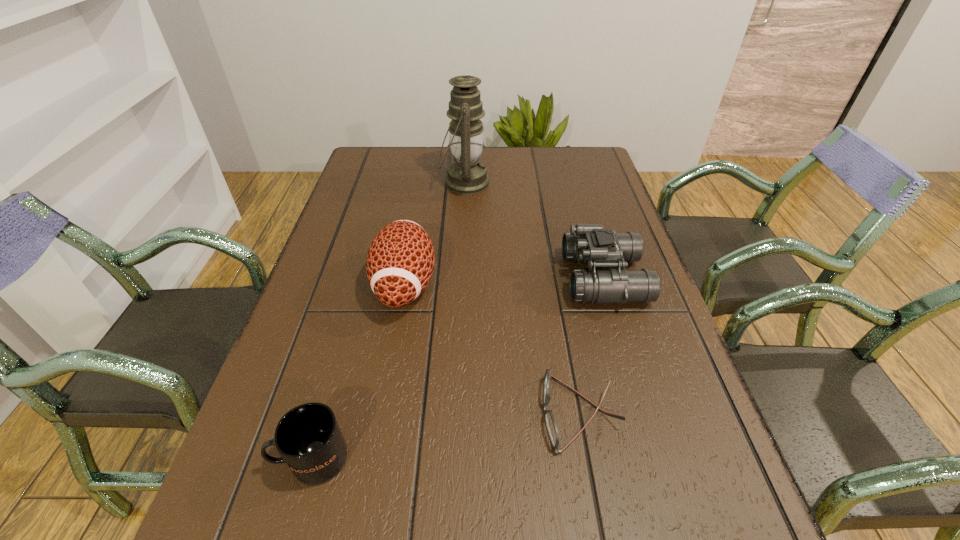
Locate an element on the screen. This screenshot has height=540, width=960. blank space at the left edge of the desktop is located at coordinates (352, 214).

The width and height of the screenshot is (960, 540). In the image, there is a desktop. What are the coordinates of `vacant space at the right edge` in the screenshot? It's located at (615, 204).

At what (x,y) coordinates should I click in order to perform the action: click on blank space at the far right corner of the desktop. Please return your answer as a coordinate pair (x, y). Looking at the image, I should click on (568, 171).

Image resolution: width=960 pixels, height=540 pixels. In order to click on free space between the mug and the spectacles in this screenshot , I will do `click(445, 436)`.

Where is `vacant space in between the shortest object and the second shortest object`? vacant space in between the shortest object and the second shortest object is located at coordinates (445, 436).

Locate an element on the screen. empty space that is in between the football and the shortest object is located at coordinates (492, 349).

Locate an element on the screen. vacant point located between the binoculars and the farthest object is located at coordinates (535, 231).

Image resolution: width=960 pixels, height=540 pixels. Find the location of `free space between the oil lamp and the binoculars`. free space between the oil lamp and the binoculars is located at coordinates (535, 231).

Locate an element on the screen. The height and width of the screenshot is (540, 960). unoccupied area between the football and the third shortest object is located at coordinates (504, 281).

Locate which object is the second closest to the third tallest object. Please provide its 2D coordinates. Your answer should be formatted as a tuple, i.e. [(x, y)], where the tuple contains the x and y coordinates of a point satisfying the conditions above.

[(467, 175)]